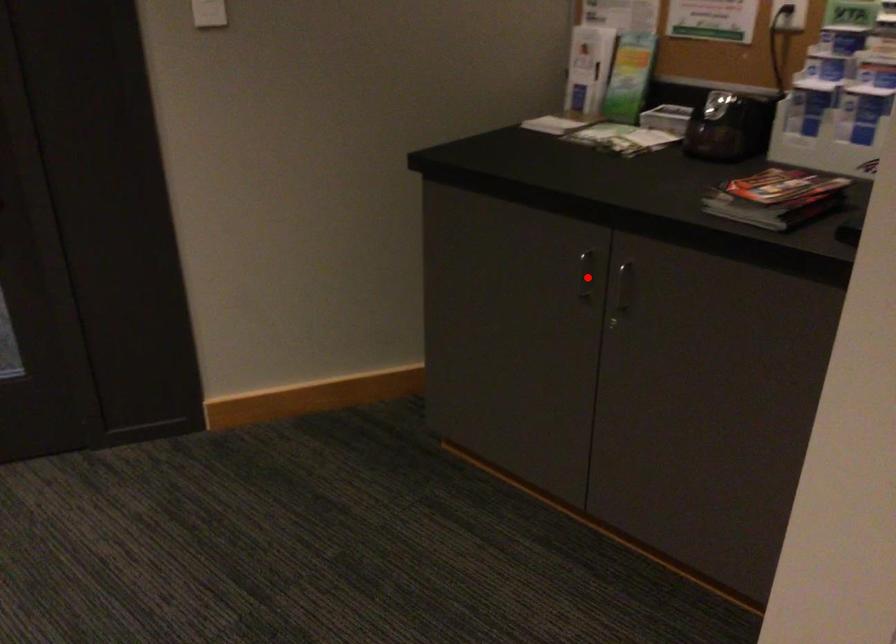
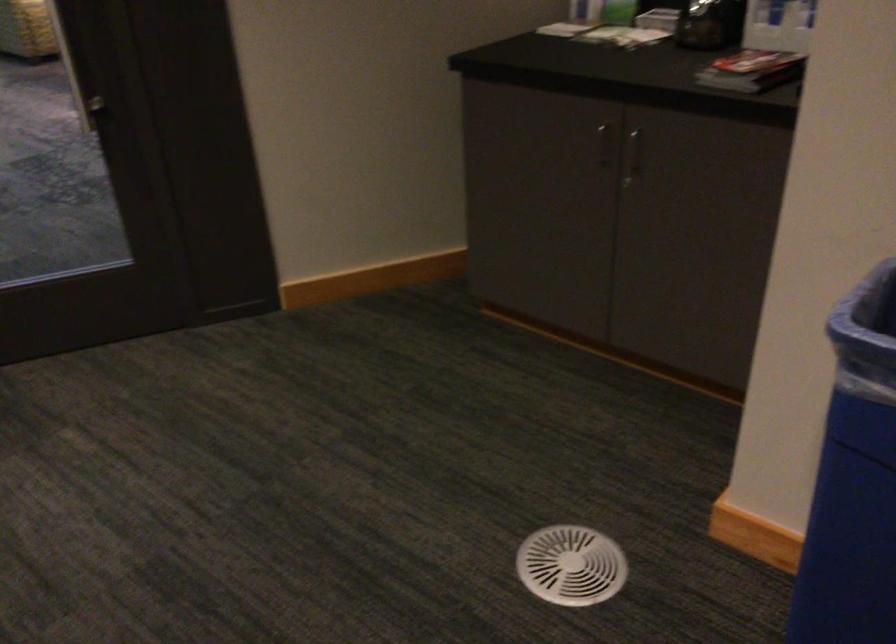
Question: I am providing you with two images of the same scene from different viewpoints. A red point is marked on the first image. Is the red point's position out of view in image 2?

Choices:
 (A) Yes
 (B) No

Answer: (B)